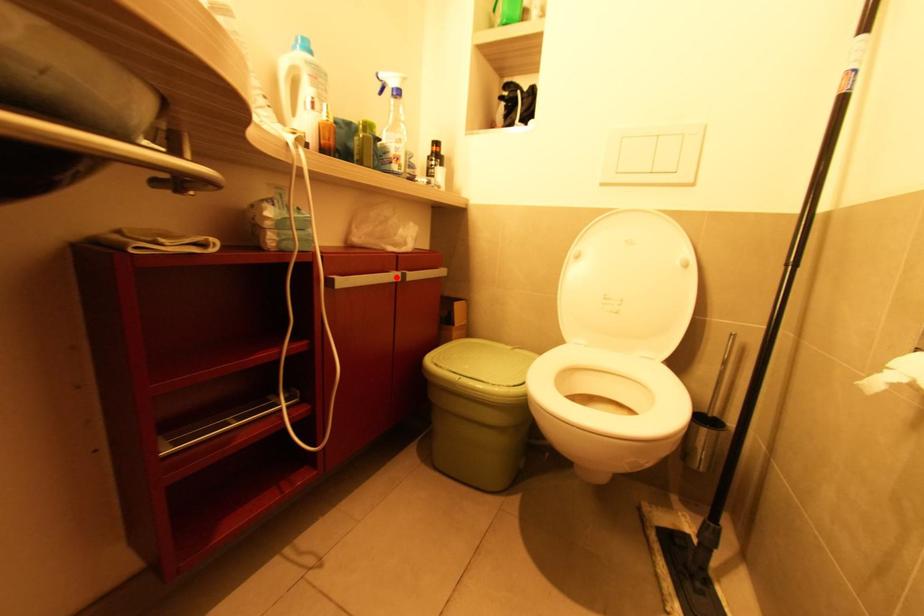
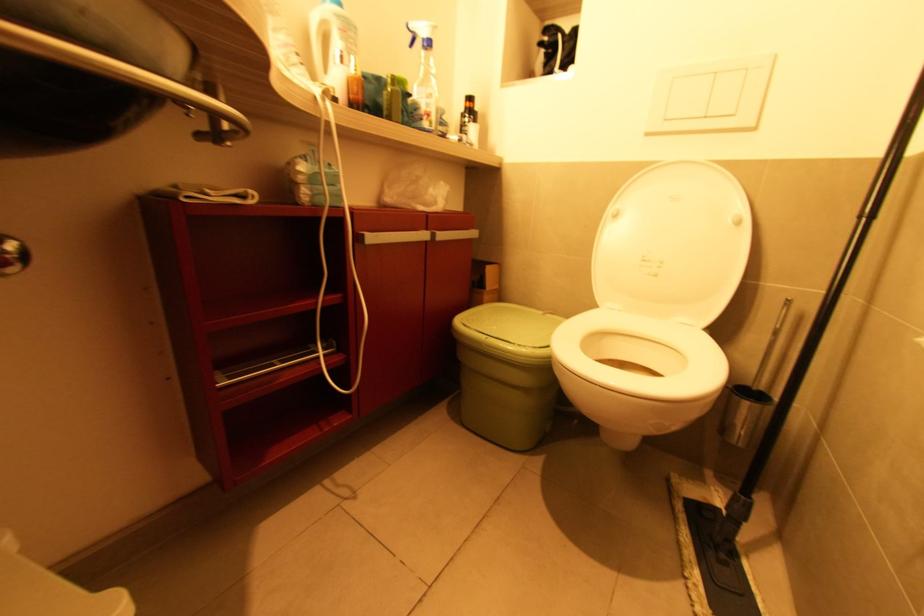
The point at the highlighted location is marked in the first image. Where is the corresponding point in the second image?

(426, 237)